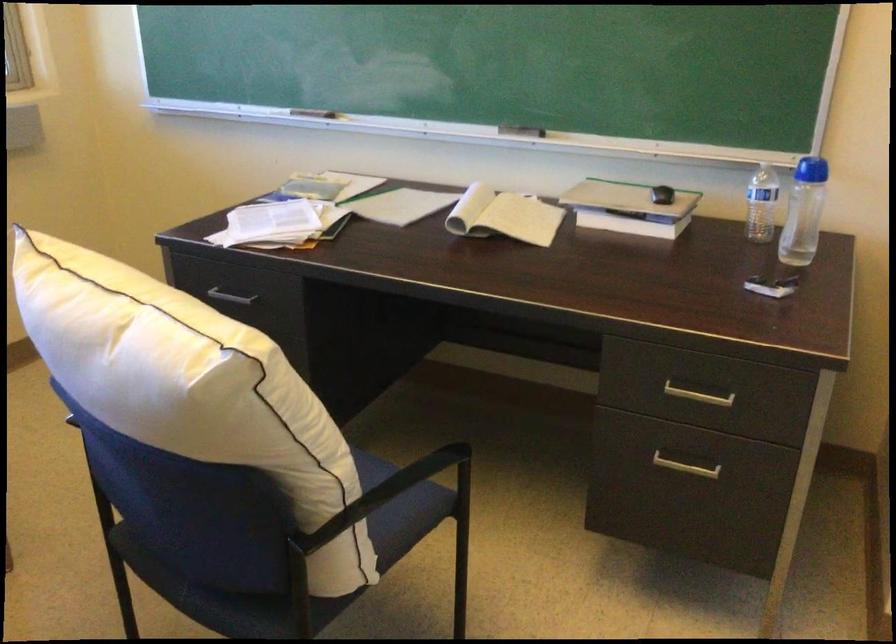
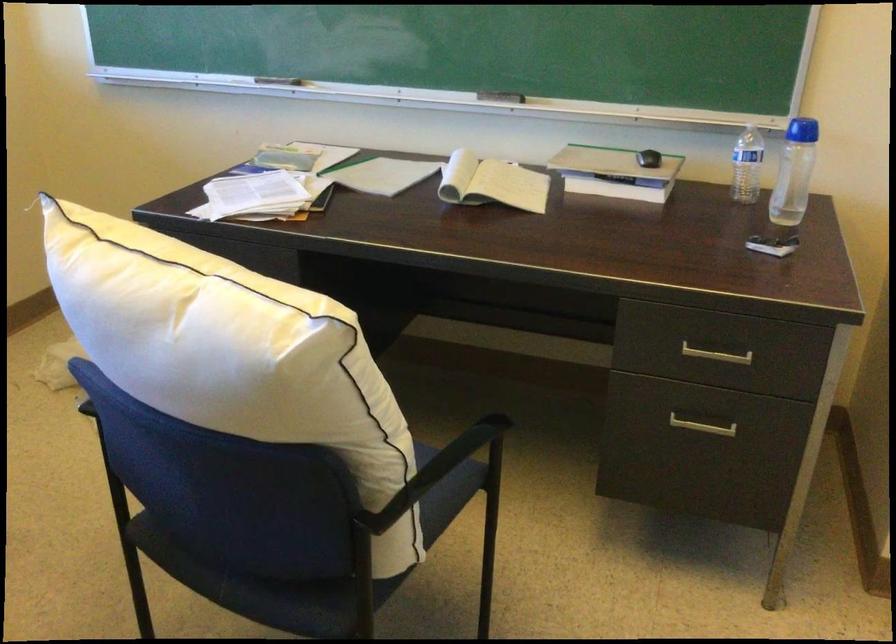
The point at (695, 397) is marked in the first image. Where is the corresponding point in the second image?

(716, 355)